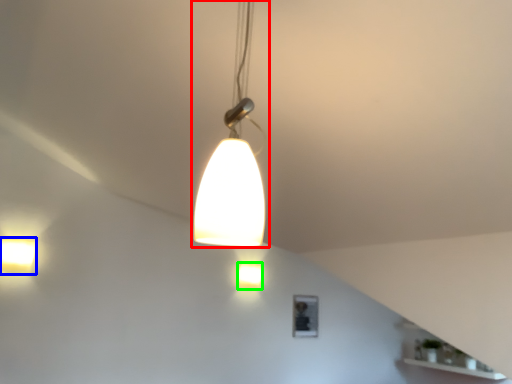
Question: Which is nearer to the lamp (highlighted by a red box)? lamp (highlighted by a blue box) or lamp (highlighted by a green box).

Choices:
 (A) lamp
 (B) lamp

Answer: (A)